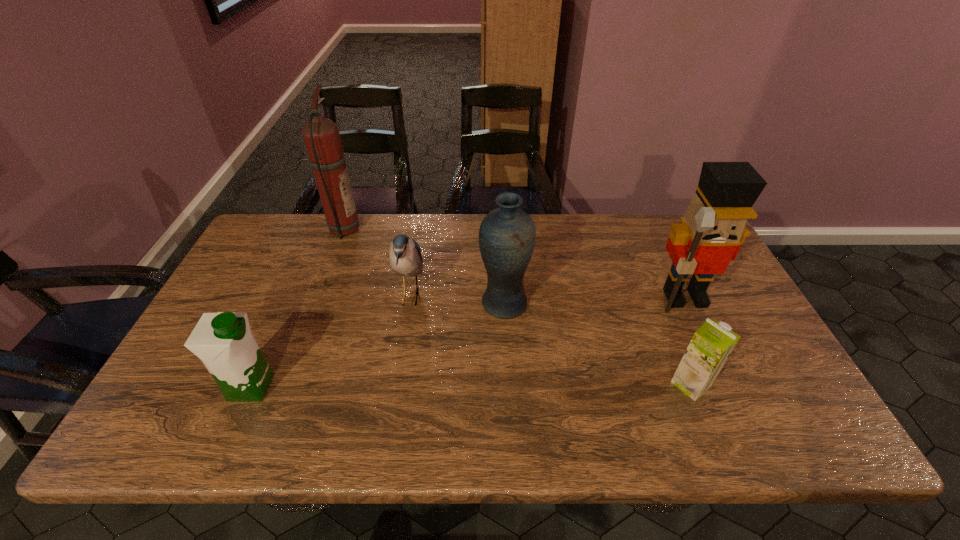
I want to click on fire extinguisher, so click(x=321, y=135).

Locate an element on the screen. nutcracker is located at coordinates (712, 230).

Find the location of a particular element. This screenshot has width=960, height=540. vase is located at coordinates tap(507, 235).

Locate an element on the screen. Image resolution: width=960 pixels, height=540 pixels. the left soya milk is located at coordinates click(223, 341).

In order to click on the third object from left to right in this screenshot , I will do `click(405, 259)`.

Where is `the right soya milk`? the right soya milk is located at coordinates (711, 345).

The width and height of the screenshot is (960, 540). Find the location of `vacant space located 0.300m on the side of the farthest object with the label and nozzle`. vacant space located 0.300m on the side of the farthest object with the label and nozzle is located at coordinates (448, 229).

You are a GUI agent. You are given a task and a screenshot of the screen. Output one action in this format:
    pyautogui.click(x=<x>, y=<y>)
    Task: Click on the free space located in front of the nutcracker holding the staff
    
    Given the screenshot: What is the action you would take?
    pyautogui.click(x=708, y=345)

The image size is (960, 540). In order to click on vacant space situated 0.260m on the front of the vase in this screenshot , I will do `click(510, 410)`.

The image size is (960, 540). Identify the location of vacant space located on the front-facing side of the left soya milk. (374, 387).